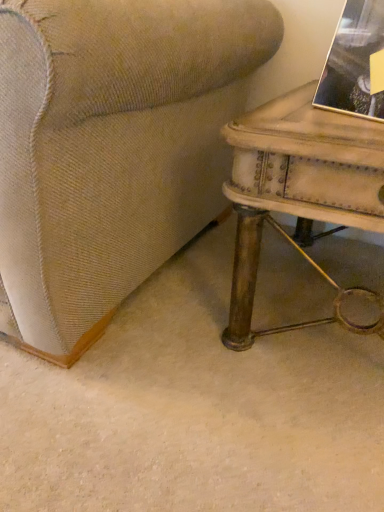
Where is `free point to the left of gold-framed photo at upper right`? This screenshot has height=512, width=384. free point to the left of gold-framed photo at upper right is located at coordinates (280, 116).